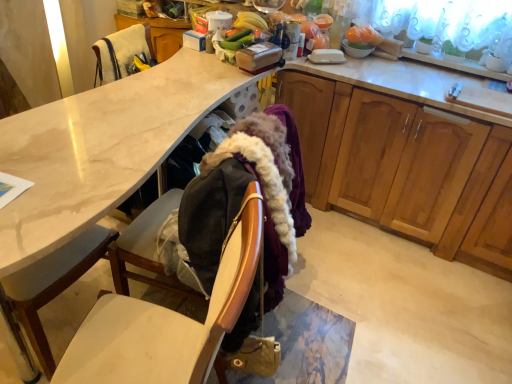
Find the location of a particular element. The width and height of the screenshot is (512, 384). vacant area that lies in front of white glossy bowl at upper right is located at coordinates (360, 69).